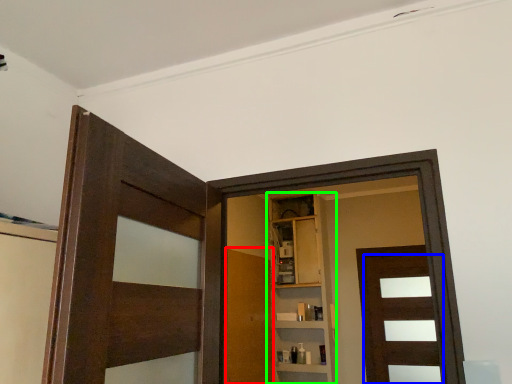
Question: Which object is positioned farthest from door (highlighted by a red box)? Select from door (highlighted by a blue box) and cabinetry (highlighted by a green box).

Choices:
 (A) door
 (B) cabinetry

Answer: (A)